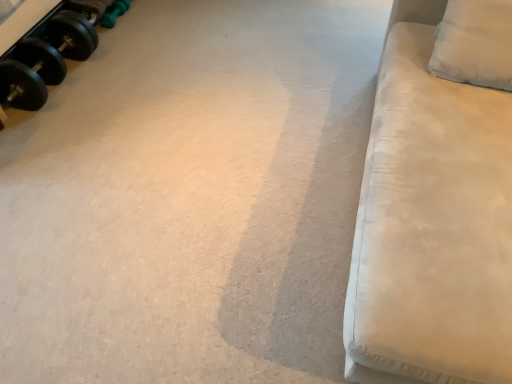
Identify the location of free location to the right of green rubber dumbbell at upper left, marked as the 2th dumbbell in a front-to-back arrangement. The height and width of the screenshot is (384, 512). (140, 22).